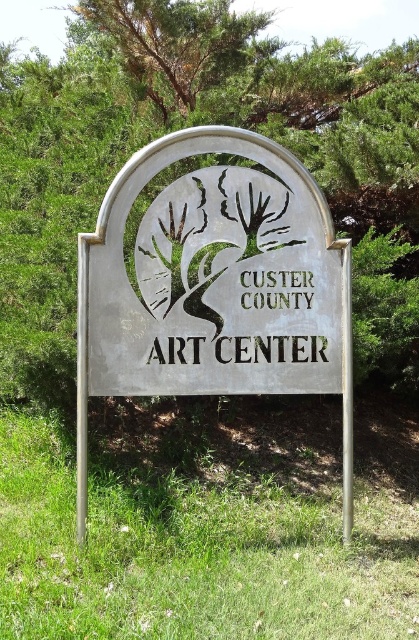
You are standing in front of the Custer County Art Center and notice both the metallic silver sign at center and the green leafy tree at upper center. Which object is positioned higher up in the scene?

The green leafy tree at upper center is positioned higher up in the scene than the metallic silver sign at center.

You are a photographer trying to capture the entire metallic silver sign at center and the green leafy tree at upper center in a single frame. Based on their sizes, which one should you focus on to ensure both fit in the photo?

The metallic silver sign at center is bigger than the green leafy tree at upper center, so you should focus on the metallic silver sign at center to ensure both fit in the photo.